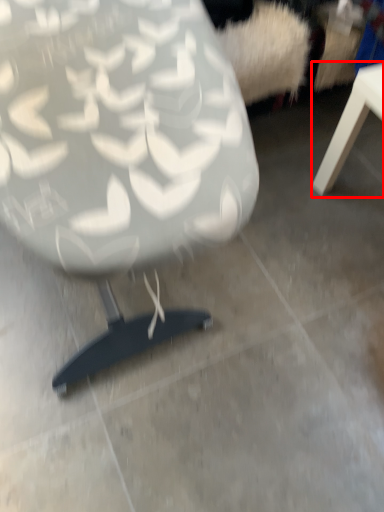
Question: From the image's perspective, where is table (annotated by the red box) located relative to chair?

Choices:
 (A) below
 (B) above

Answer: (A)